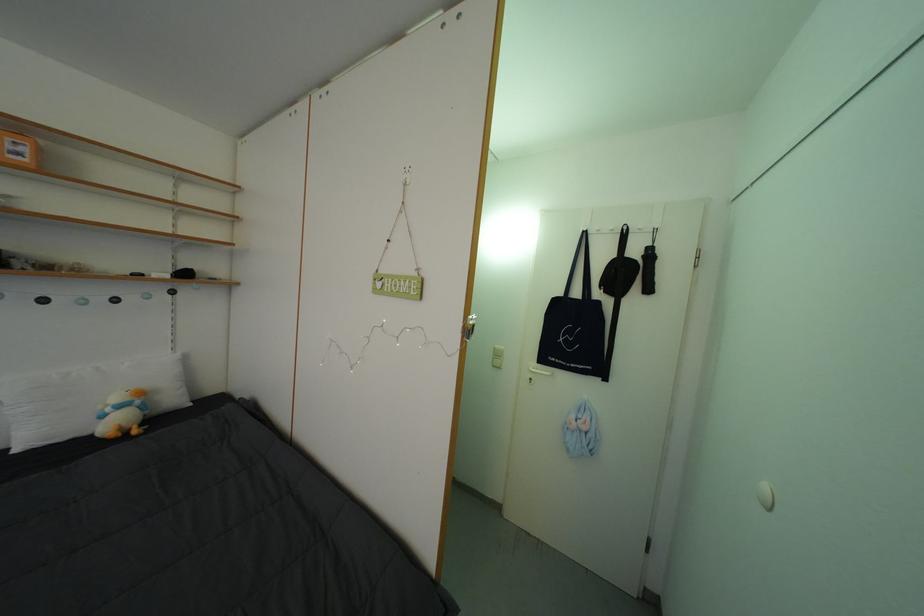
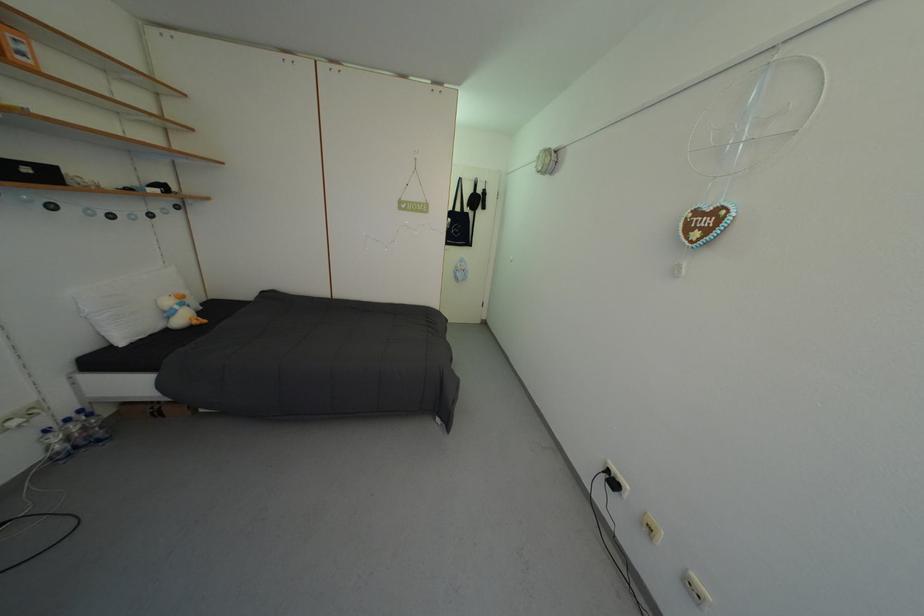
In the second image, find the point that corresponds to (x=117, y=415) in the first image.

(186, 313)